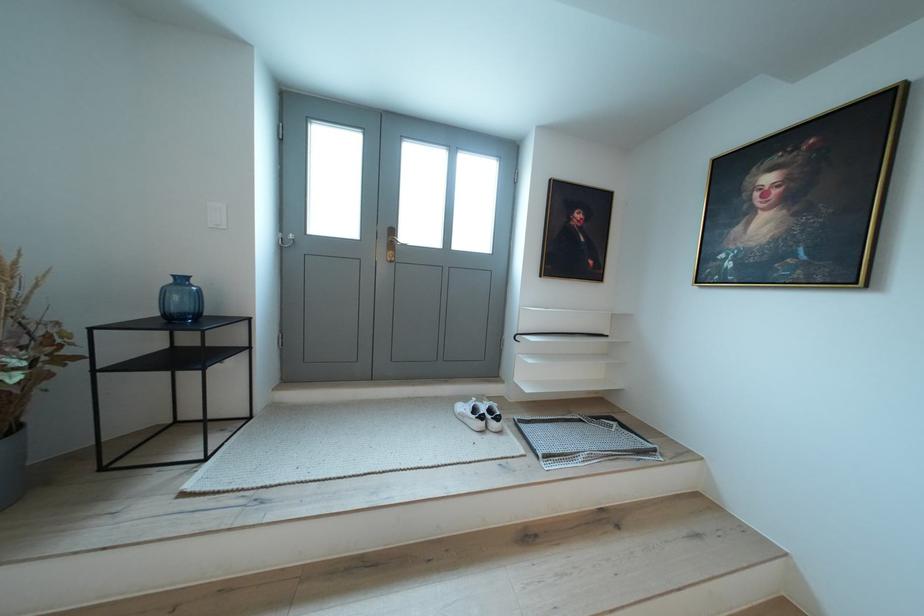
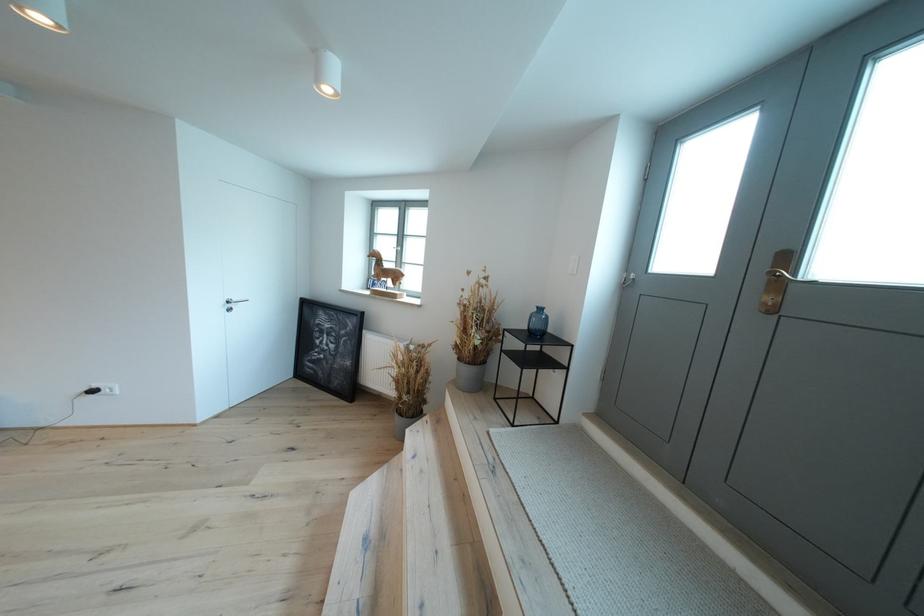
Question: The images are taken continuously from a first-person perspective. In which direction is your viewpoint rotating?

Choices:
 (A) Left
 (B) Right
 (C) Up
 (D) Down

Answer: (A)